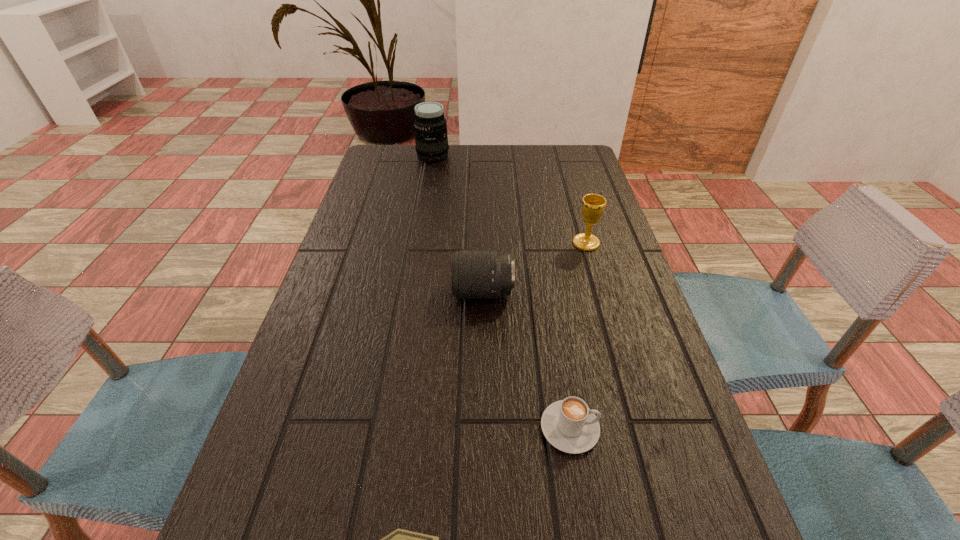
Find the location of `the farther telephoto lens`. the farther telephoto lens is located at coordinates (431, 139).

Where is `the tallest object`? the tallest object is located at coordinates (431, 139).

The height and width of the screenshot is (540, 960). In order to click on chalice in this screenshot , I will do `click(593, 205)`.

The image size is (960, 540). I want to click on the fourth nearest object, so click(593, 205).

The height and width of the screenshot is (540, 960). In order to click on the nearer telephoto lens in this screenshot , I will do `click(475, 274)`.

Image resolution: width=960 pixels, height=540 pixels. What are the coordinates of `the third nearest object` in the screenshot? It's located at (475, 274).

Identify the location of the fourth farthest object. (569, 425).

Where is `the fourth tallest object`? The width and height of the screenshot is (960, 540). the fourth tallest object is located at coordinates (569, 425).

This screenshot has width=960, height=540. I want to click on free space located 0.320m on the front of the left telephoto lens, so click(422, 219).

In order to click on vacant area situated on the back of the fourth shortest object in this screenshot , I will do `click(565, 173)`.